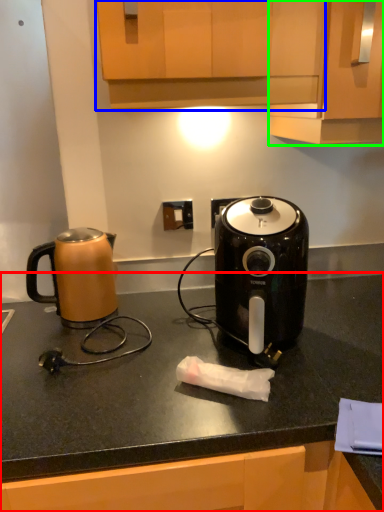
Question: Which object is the closest to the countertop (highlighted by a red box)? Choose among these: cabinetry (highlighted by a blue box) or cabinetry (highlighted by a green box).

Choices:
 (A) cabinetry
 (B) cabinetry

Answer: (B)